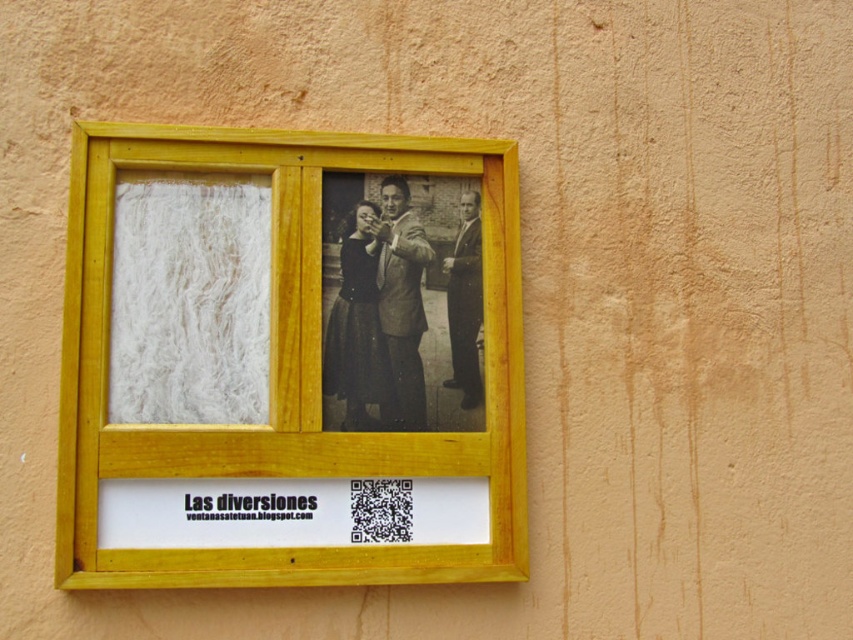
You are standing in front of a wall with a yellow wooden frame. There are two points marked on the frame. You want to place a small sticker on the point that is closer to you. Which point should you choose between the point at coordinates point (99, 385) and point (410, 243)?

The point at coordinates point (99, 385) is in front of point (410, 243), so you should choose point (99, 385) to place the sticker as it is closer to you.

You are standing in front of the yellow wooden frame on the beige wall. You notice a point at coordinates (502, 442) and the camera in the photograph. If you want to touch both the point and the camera with your finger, which one would require you to move your hand further? Please answer based on the distance between them.

The point at coordinates (502, 442) and the camera are 5.03 feet apart. Since the camera is part of the photograph inside the frame, you can touch both by reaching out to the frame. However, the physical distance between them on the frame is 5.03 feet, so moving your hand to touch the camera would require moving further from the point.

You are hanging a new picture on the wall next to the yellow wood photo frame at upper left and the black glossy suit at center. Since you want to maintain symmetry, which object should you place the new picture closer to and why?

The yellow wood photo frame at upper left is bigger than the black glossy suit at center, so to maintain symmetry, you should place the new picture closer to the black glossy suit at center to balance the visual weight.